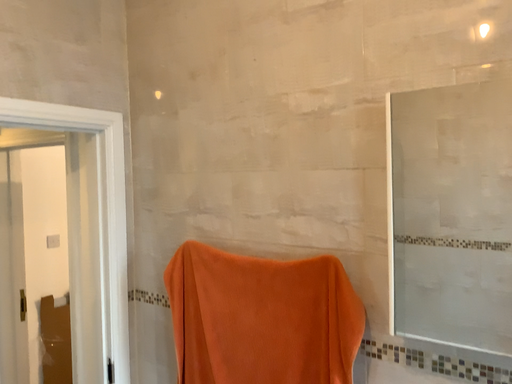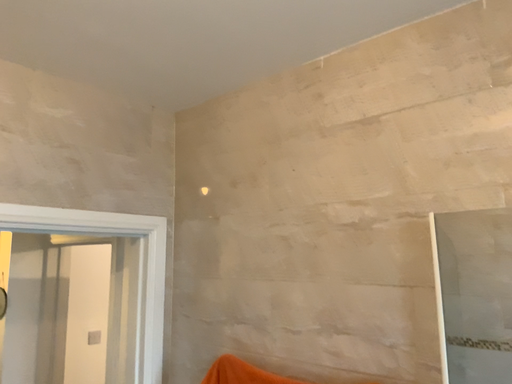
Question: Which way did the camera rotate in the video?

Choices:
 (A) rotated upward
 (B) rotated downward

Answer: (A)